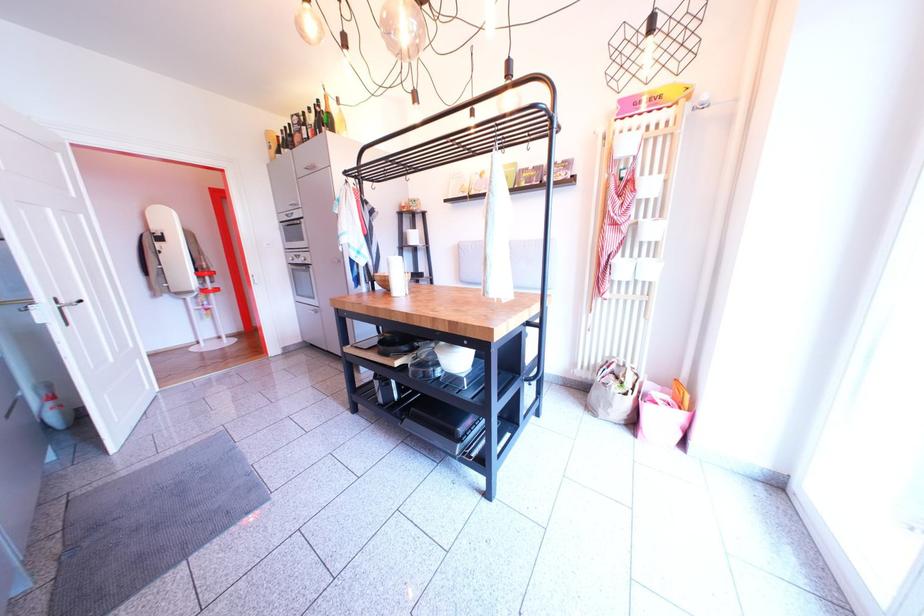
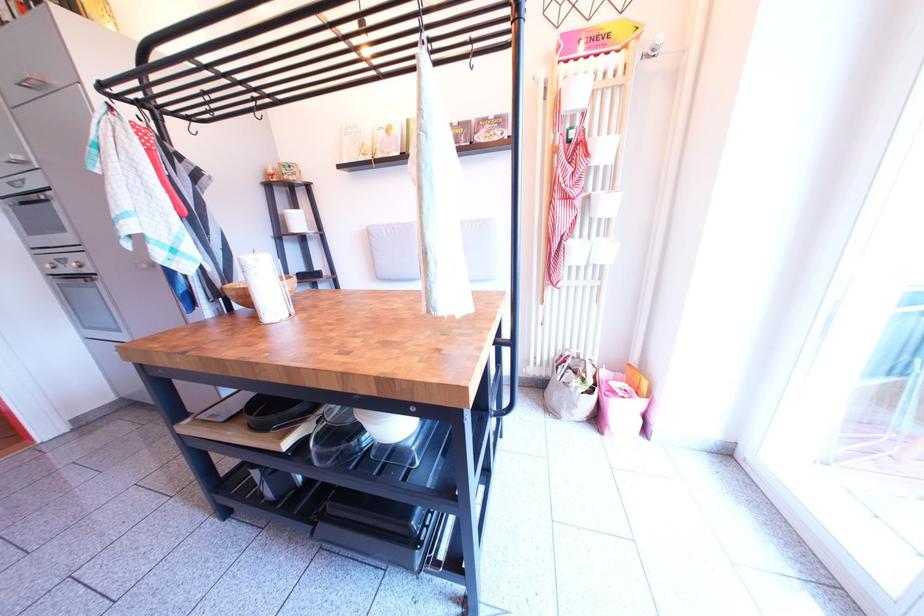
The point at (478, 191) is marked in the first image. Where is the corresponding point in the second image?

(380, 150)